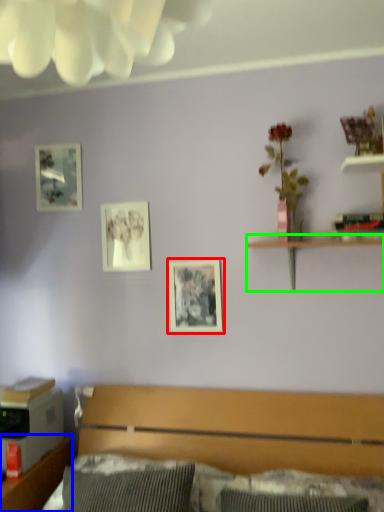
Question: Based on their relative distances, which object is nearer to picture frame (highlighted by a red box)? Choose from dresser (highlighted by a blue box) and shelf (highlighted by a green box).

Choices:
 (A) dresser
 (B) shelf

Answer: (B)